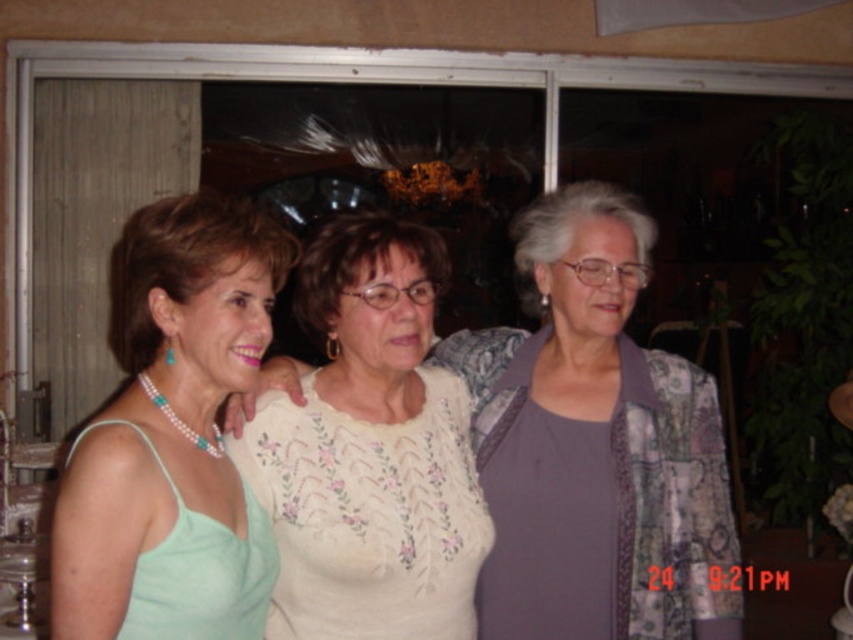
You are at a party and see the pearl necklace at left and the white embroidered blouse at center. Which one is positioned more to the left side?

The pearl necklace at left is positioned more to the left side than the white embroidered blouse at center.

You are organizing a photo shoot and need to ensure that the pearl necklace at left and the white embroidered blouse at center are visible in the frame. Based on their sizes, which object might require more careful framing to avoid being too small in the photo?

The pearl necklace at left has a lesser width compared to the white embroidered blouse at center, so it might require more careful framing to ensure it isn not too small in the photo.

You are at a social event and see two items on the same person. The purple fabric at center and the white embroidered blouse at center. Which one is higher up?

The purple fabric at center is located above the white embroidered blouse at center.